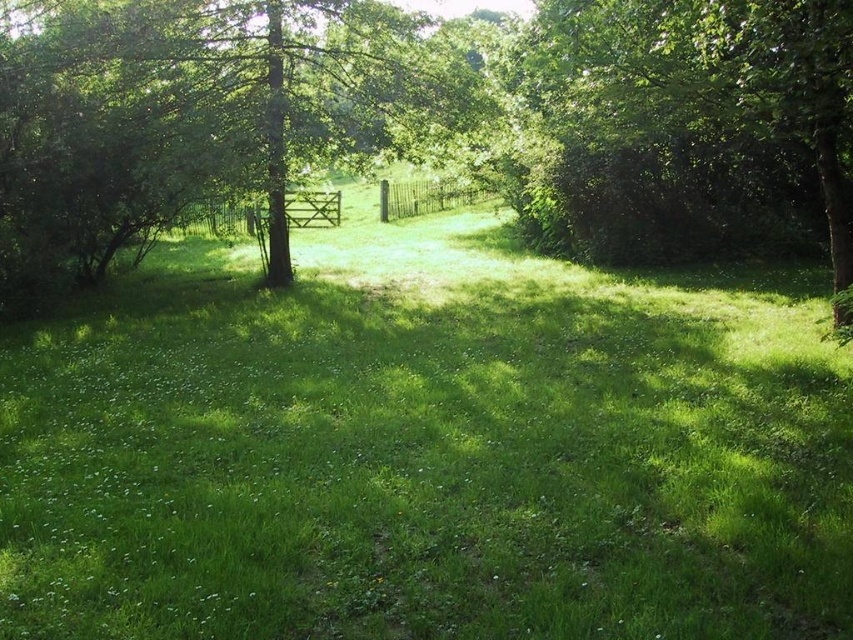
You are standing in the meadow and want to take a photo of both the point at coordinates (x=202, y=227) and the point at (x=379, y=189). Which point will appear larger in the photo?

Point at coordinates (x=202, y=227) will appear larger in the photo because it is closer to the camera than point at coordinates (x=379, y=189).